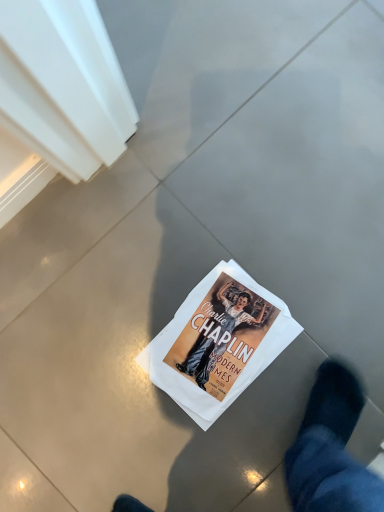
I want to click on vacant space situated above white paper comic book at center (from a real-world perspective), so click(209, 339).